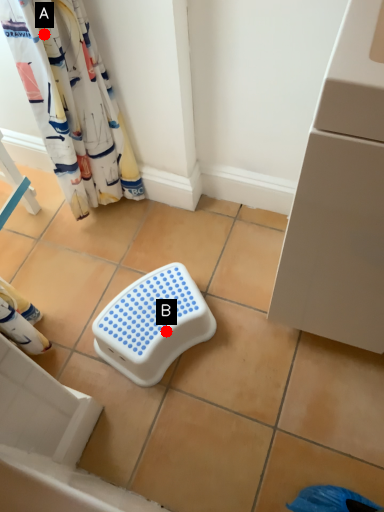
Question: Two points are circled on the image, labeled by A and B beside each circle. Which point is farther to the camera?

Choices:
 (A) A is further
 (B) B is further

Answer: (B)